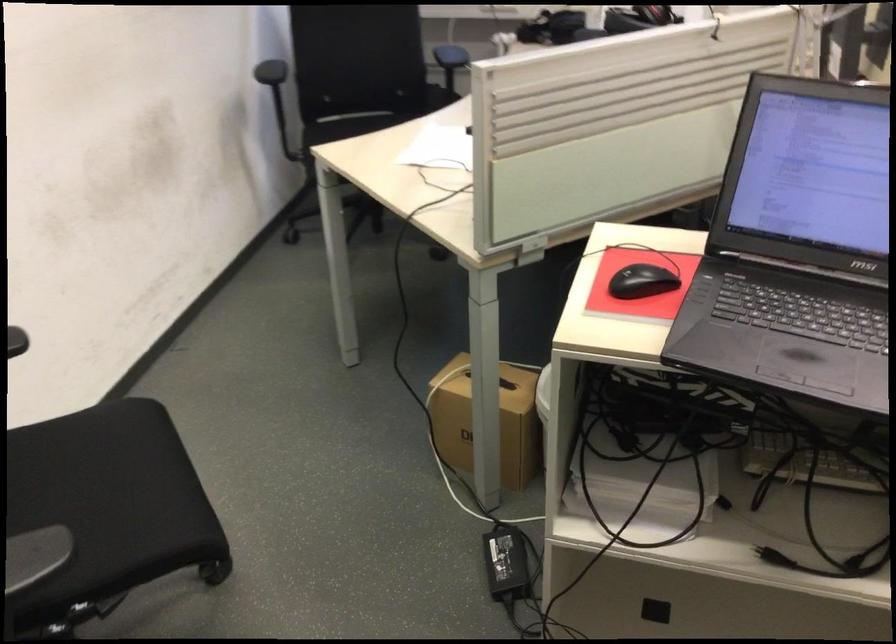
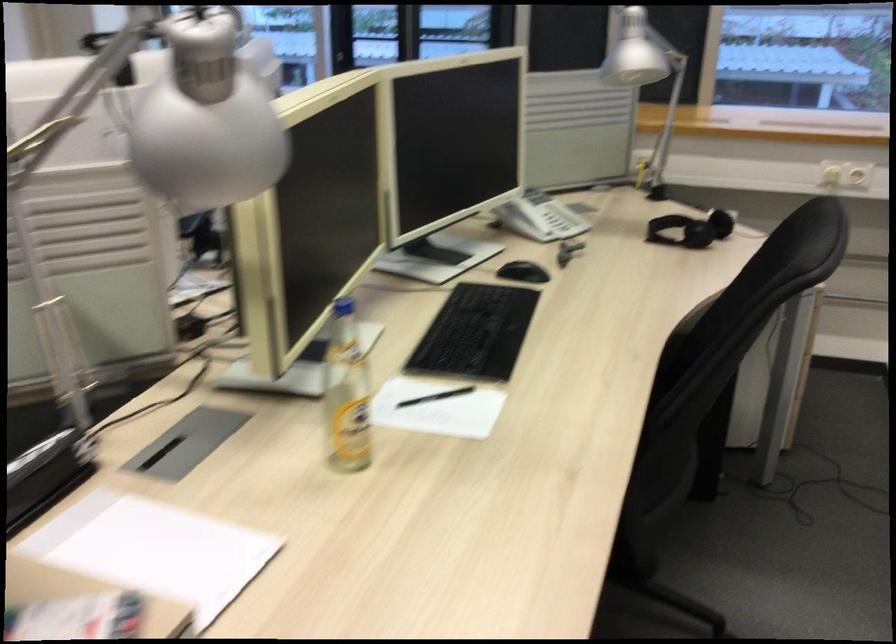
Question: The images are taken continuously from a first-person perspective. In which direction are you moving?

Choices:
 (A) Left
 (B) Right
 (C) Forward
 (D) Backward

Answer: (B)